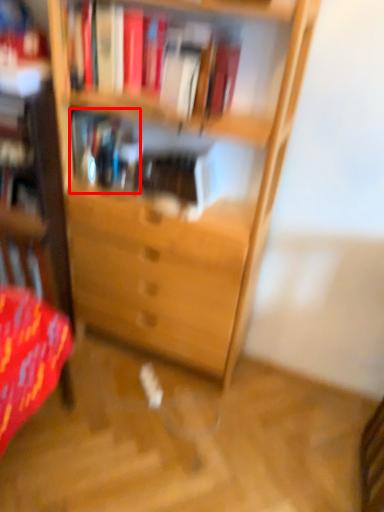
Question: Where is book (annotated by the red box) located in relation to book in the image?

Choices:
 (A) right
 (B) left

Answer: (B)